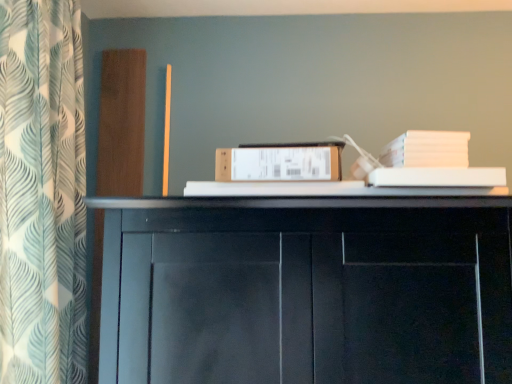
Question: From a real-world perspective, is white cardboard box at center under white leaf-patterned curtain at left?

Choices:
 (A) yes
 (B) no

Answer: (A)

Question: Does white cardboard box at center turn towards white leaf-patterned curtain at left?

Choices:
 (A) yes
 (B) no

Answer: (B)

Question: Can you confirm if white cardboard box at center is positioned to the left of white leaf-patterned curtain at left?

Choices:
 (A) yes
 (B) no

Answer: (B)

Question: Is white cardboard box at center beside white leaf-patterned curtain at left?

Choices:
 (A) no
 (B) yes

Answer: (A)

Question: Is white cardboard box at center taller than white leaf-patterned curtain at left?

Choices:
 (A) no
 (B) yes

Answer: (A)

Question: From a real-world perspective, does white cardboard box at center stand above white leaf-patterned curtain at left?

Choices:
 (A) yes
 (B) no

Answer: (B)

Question: Considering the relative sizes of white leaf-patterned curtain at left and white cardboard box at center in the image provided, is white leaf-patterned curtain at left wider than white cardboard box at center?

Choices:
 (A) yes
 (B) no

Answer: (A)

Question: From the image's perspective, would you say white leaf-patterned curtain at left is shown under white cardboard box at center?

Choices:
 (A) yes
 (B) no

Answer: (B)

Question: Is white leaf-patterned curtain at left far away from white cardboard box at center?

Choices:
 (A) no
 (B) yes

Answer: (A)

Question: From a real-world perspective, is white leaf-patterned curtain at left positioned over white cardboard box at center based on gravity?

Choices:
 (A) yes
 (B) no

Answer: (A)

Question: Can you confirm if white leaf-patterned curtain at left is positioned to the right of white cardboard box at center?

Choices:
 (A) yes
 (B) no

Answer: (B)

Question: Can you confirm if white leaf-patterned curtain at left is smaller than white cardboard box at center?

Choices:
 (A) no
 (B) yes

Answer: (A)

Question: In terms of height, does white leaf-patterned curtain at left look taller or shorter compared to white cardboard box at center?

Choices:
 (A) tall
 (B) short

Answer: (A)